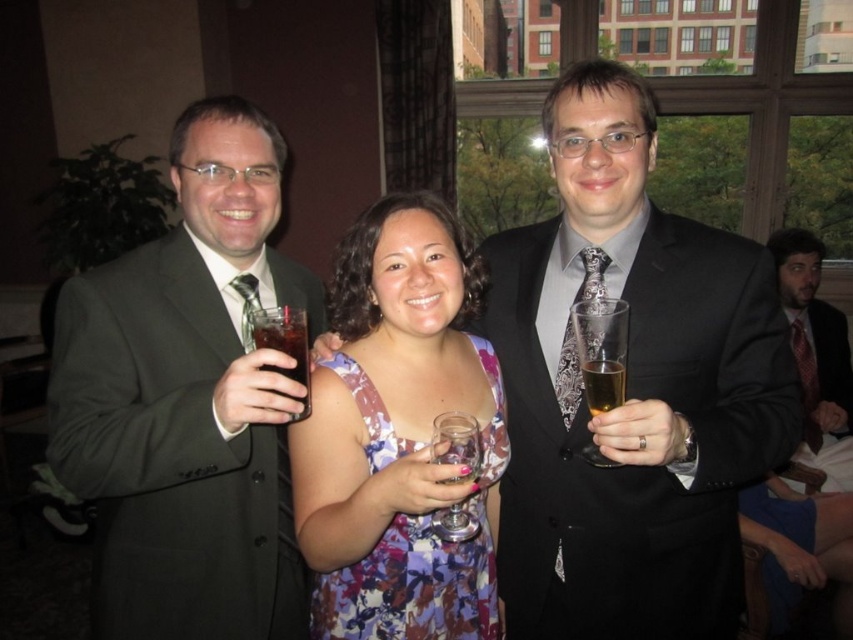
Question: Which point is closer to the camera?

Choices:
 (A) (621, 403)
 (B) (585, 300)
 (C) (820, 369)

Answer: (A)

Question: Can you confirm if floral fabric dress at center is positioned to the right of dark brown liquid at upper left?

Choices:
 (A) yes
 (B) no

Answer: (A)

Question: Which of these objects is positioned closest to the clear glass at right?

Choices:
 (A) dark brown liquid at upper left
 (B) matte black suit at left
 (C) matte black suit at center

Answer: (C)

Question: Which point is closer to the camera?

Choices:
 (A) (306, 340)
 (B) (610, 397)
 (C) (503, 420)

Answer: (B)

Question: Is floral fabric dress at center further to camera compared to dark brown liquid at upper left?

Choices:
 (A) no
 (B) yes

Answer: (B)

Question: Does matte black suit at left lie in front of floral fabric dress at center?

Choices:
 (A) yes
 (B) no

Answer: (A)